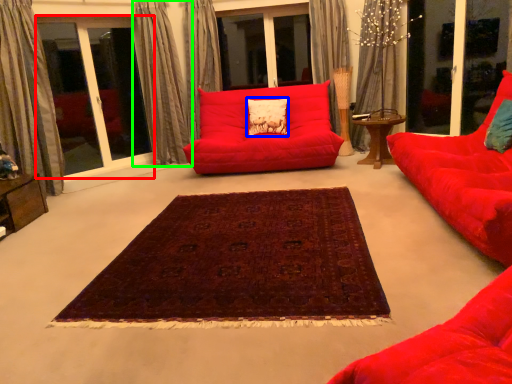
Question: Estimate the real-world distances between objects in this image. Which object is farther from bay window (highlighted by a red box), pillow (highlighted by a blue box) or curtain (highlighted by a green box)?

Choices:
 (A) pillow
 (B) curtain

Answer: (A)